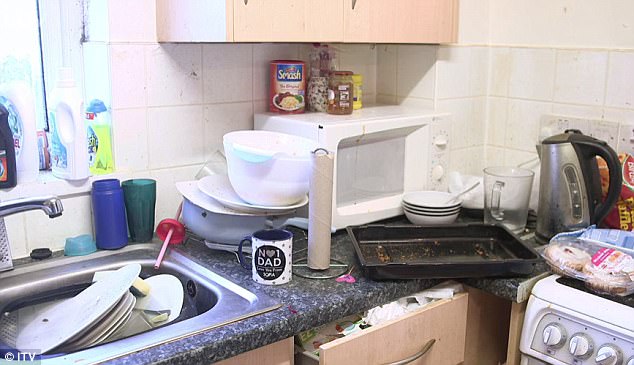
Where is `stove dial control`? The image size is (634, 365). stove dial control is located at coordinates (553, 334), (581, 344), (603, 351).